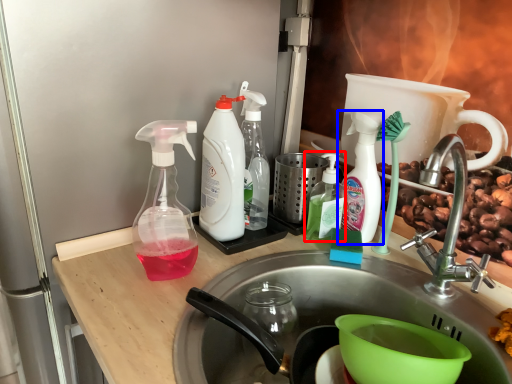
Question: Among these objects, which one is nearest to the camera, bottle (highlighted by a red box) or bottle (highlighted by a blue box)?

Choices:
 (A) bottle
 (B) bottle

Answer: (B)